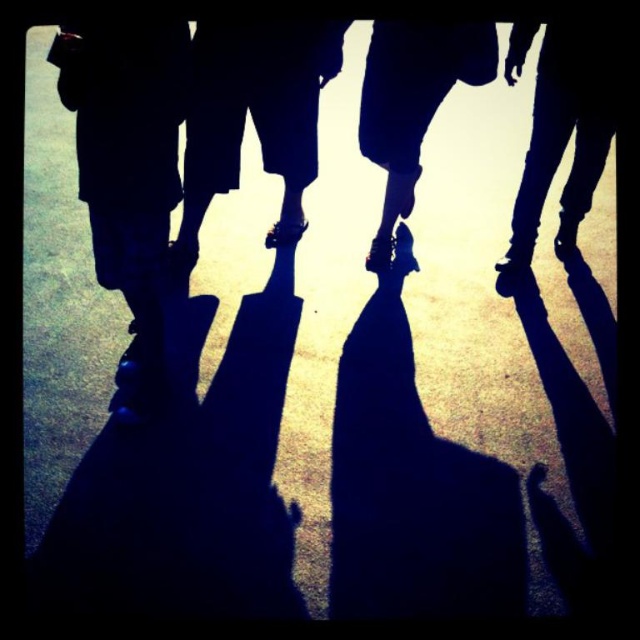
Can you confirm if black matte shorts at left is smaller than shiny black shoe at center?

Incorrect, black matte shorts at left is not smaller in size than shiny black shoe at center.

Based on the photo, is black matte shorts at left bigger than shiny black shoe at center?

Yes, black matte shorts at left is bigger than shiny black shoe at center.

Is point (148, 216) farther from viewer compared to point (388, 20)?

That is False.

At what (x,y) coordinates should I click in order to perform the action: click on black matte shorts at left. Please return your answer as a coordinate pair (x, y). Looking at the image, I should click on (129, 173).

Is point (330, 38) positioned after point (406, 161)?

No.

Does matte black sandals at center have a smaller size compared to shiny black shoe at center?

Incorrect, matte black sandals at center is not smaller in size than shiny black shoe at center.

The height and width of the screenshot is (640, 640). What do you see at coordinates (253, 115) in the screenshot?
I see `matte black sandals at center` at bounding box center [253, 115].

This screenshot has width=640, height=640. In order to click on matte black sandals at center in this screenshot , I will do `click(253, 115)`.

Which is behind, point (81, 44) or point (296, 68)?

The point (296, 68) is behind.

Image resolution: width=640 pixels, height=640 pixels. Identify the location of black matte shorts at left. 129,173.